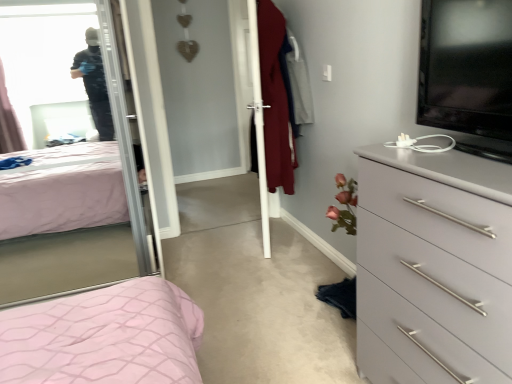
Question: Does gray matte chest of drawers at right have a lesser width compared to clear glass mirror at upper left?

Choices:
 (A) no
 (B) yes

Answer: (B)

Question: Is gray matte chest of drawers at right to the right of clear glass mirror at upper left from the viewer's perspective?

Choices:
 (A) yes
 (B) no

Answer: (A)

Question: Is gray matte chest of drawers at right turned away from clear glass mirror at upper left?

Choices:
 (A) no
 (B) yes

Answer: (A)

Question: Is clear glass mirror at upper left located within gray matte chest of drawers at right?

Choices:
 (A) no
 (B) yes

Answer: (A)

Question: Could you tell me if gray matte chest of drawers at right is facing clear glass mirror at upper left?

Choices:
 (A) yes
 (B) no

Answer: (B)

Question: From a real-world perspective, is white glossy screen door at center above or below clear glass mirror at upper left?

Choices:
 (A) above
 (B) below

Answer: (B)

Question: Is white glossy screen door at center taller or shorter than clear glass mirror at upper left?

Choices:
 (A) tall
 (B) short

Answer: (B)

Question: Visually, is white glossy screen door at center positioned to the left or to the right of clear glass mirror at upper left?

Choices:
 (A) right
 (B) left

Answer: (A)

Question: Looking at their shapes, would you say white glossy screen door at center is wider or thinner than clear glass mirror at upper left?

Choices:
 (A) wide
 (B) thin

Answer: (B)

Question: Considering the relative positions of clear glass mirror at upper left and gray matte chest of drawers at right in the image provided, is clear glass mirror at upper left to the left or to the right of gray matte chest of drawers at right?

Choices:
 (A) left
 (B) right

Answer: (A)

Question: Does point (86, 211) appear closer or farther from the camera than point (359, 274)?

Choices:
 (A) closer
 (B) farther

Answer: (B)

Question: Is clear glass mirror at upper left bigger or smaller than gray matte chest of drawers at right?

Choices:
 (A) big
 (B) small

Answer: (A)

Question: Do you think clear glass mirror at upper left is within gray matte chest of drawers at right, or outside of it?

Choices:
 (A) inside
 (B) outside

Answer: (B)

Question: From the image's perspective, is black glossy tv at upper right located above or below gray matte chest of drawers at right?

Choices:
 (A) below
 (B) above

Answer: (B)

Question: Is black glossy tv at upper right to the left or to the right of gray matte chest of drawers at right in the image?

Choices:
 (A) left
 (B) right

Answer: (A)